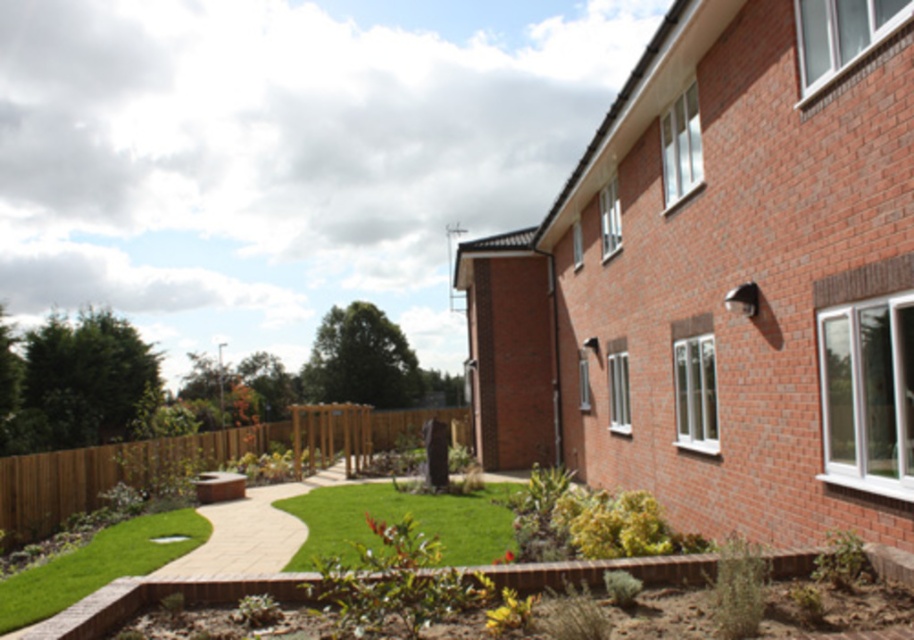
You are standing at the entrance of the brick building and see the point marked at coordinates (194,460). What object is located at that point?

The point at coordinates (194,460) indicates the brown wooden fence at lower center.

You are a gardener standing on the green lawn at center and want to reach the brown wooden fence at lower center. Which direction should you move to get there?

The brown wooden fence at lower center is located below the green lawn at center, so you should move downward or forward to reach it.

You are standing at the entrance of the garden and want to walk towards the wooden fence. Which surface will you step on first, the green lawn at center or the green artificial turf at lower left?

The green lawn at center is closer to the viewer than the green artificial turf at lower left, so you will step on the green lawn at center first when walking towards the wooden fence.